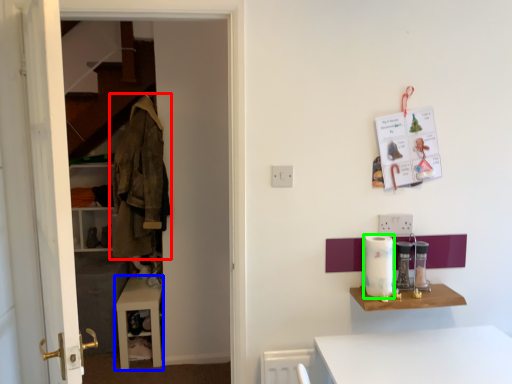
Question: Which object is positioned closest to clothing (highlighted by a red box)? Select from table (highlighted by a blue box) and appliance (highlighted by a green box).

Choices:
 (A) table
 (B) appliance

Answer: (A)